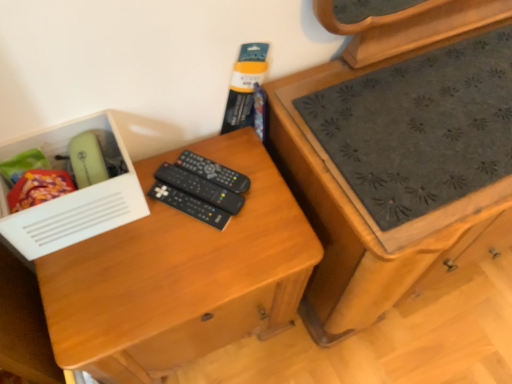
Where is `free space on the front side of white plastic box at left`? free space on the front side of white plastic box at left is located at coordinates (92, 294).